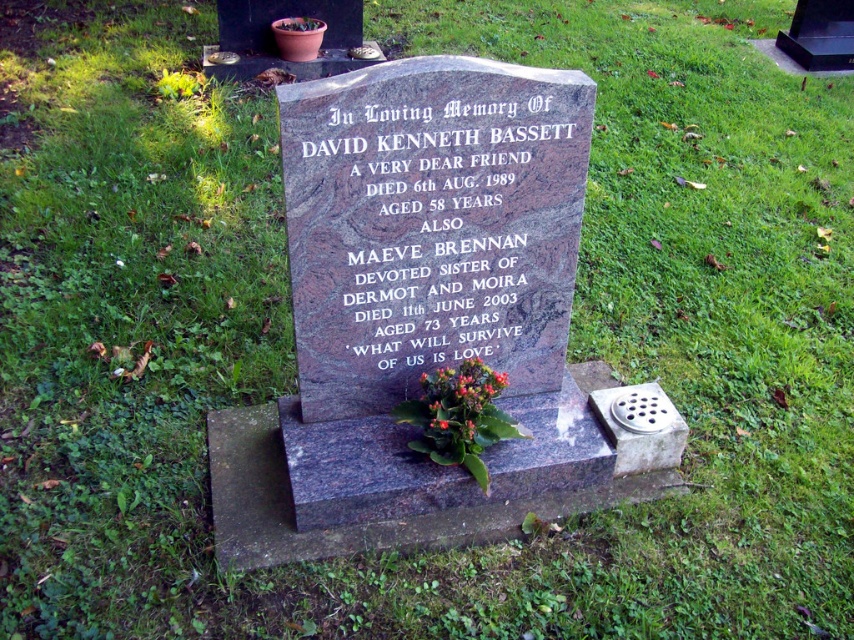
Does point (551, 464) come in front of point (560, 173)?

No, it is behind (560, 173).

Is point (430, 186) closer to viewer compared to point (459, 83)?

No, (430, 186) is further to viewer.

Find the location of `granite gravestone at center`. granite gravestone at center is located at coordinates (428, 317).

Is granite gravestone at center taller than green leafy plant at center?

Correct, granite gravestone at center is much taller as green leafy plant at center.

Locate an element on the screen. The image size is (854, 640). granite gravestone at center is located at coordinates (428, 317).

The image size is (854, 640). Find the location of `granite gravestone at center`. granite gravestone at center is located at coordinates (428, 317).

Does granite stone plaque at center have a greater width compared to green leafy plant at center?

Indeed, granite stone plaque at center has a greater width compared to green leafy plant at center.

Does granite stone plaque at center have a lesser width compared to green leafy plant at center?

Incorrect, granite stone plaque at center's width is not less than green leafy plant at center's.

What do you see at coordinates (434, 227) in the screenshot? I see `granite stone plaque at center` at bounding box center [434, 227].

Find the location of `granite stone plaque at center`. granite stone plaque at center is located at coordinates (434, 227).